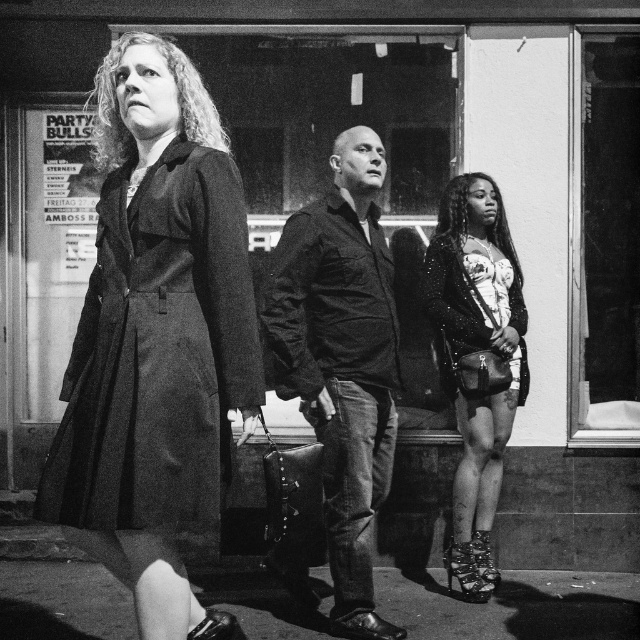
You are a photographer analyzing this black and white night scene. You notice the transparent glass at right and the shiny black pavement at lower center. Which object appears taller in the image?

The transparent glass at right appears taller than the shiny black pavement at lower center.

You are a photographer trying to focus on two specific points in the image. The first point is at coordinates point [323,316] and the second is at point [628,355]. Which point is closer to your camera lens?

Point [323,316] is closer to the camera lens than point [628,355].

You are a photographer analyzing the composition of this black and white photograph. You want to place a virtual marker at the exact center of the image to check alignment. Is the leather jacket at center positioned closer to the center of the image or further away?

The leather jacket at center is positioned at point (340,362), which is very close to the center of the image. The exact center would be at (320,320), so it is slightly offset but still near the central area.